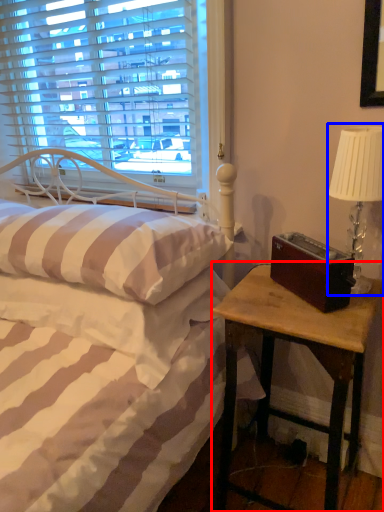
Question: Which object appears farthest to the camera in this image, nightstand (highlighted by a red box) or table lamp (highlighted by a blue box)?

Choices:
 (A) nightstand
 (B) table lamp

Answer: (B)